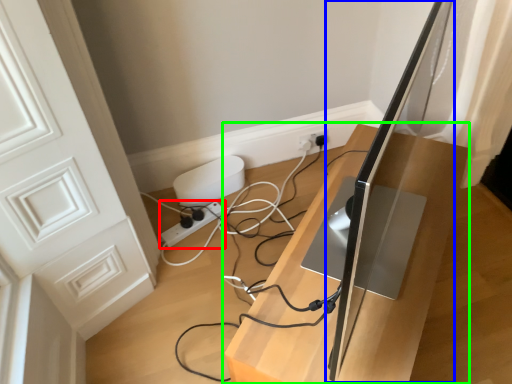
Question: Which object is positioned closest to extension cord (highlighted by a red box)? Select from computer monitor (highlighted by a blue box) and furniture (highlighted by a green box).

Choices:
 (A) computer monitor
 (B) furniture

Answer: (B)